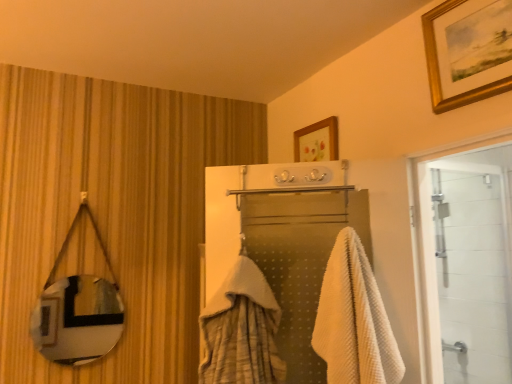
Question: Considering the positions of metallic reflective mirror at left and white waffle towel at center in the image, is metallic reflective mirror at left wider or thinner than white waffle towel at center?

Choices:
 (A) thin
 (B) wide

Answer: (A)

Question: Is metallic reflective mirror at left inside or outside of white waffle towel at center?

Choices:
 (A) outside
 (B) inside

Answer: (A)

Question: Based on their relative distances, which object is farther from the white glass door at right?

Choices:
 (A) white waffle towel at center
 (B) metallic reflective mirror at left
 (C) gold-framed picture at upper right

Answer: (B)

Question: Based on their relative distances, which object is farther from the gold-framed picture at upper right?

Choices:
 (A) white glass door at right
 (B) metallic reflective mirror at left
 (C) white waffle towel at center

Answer: (B)